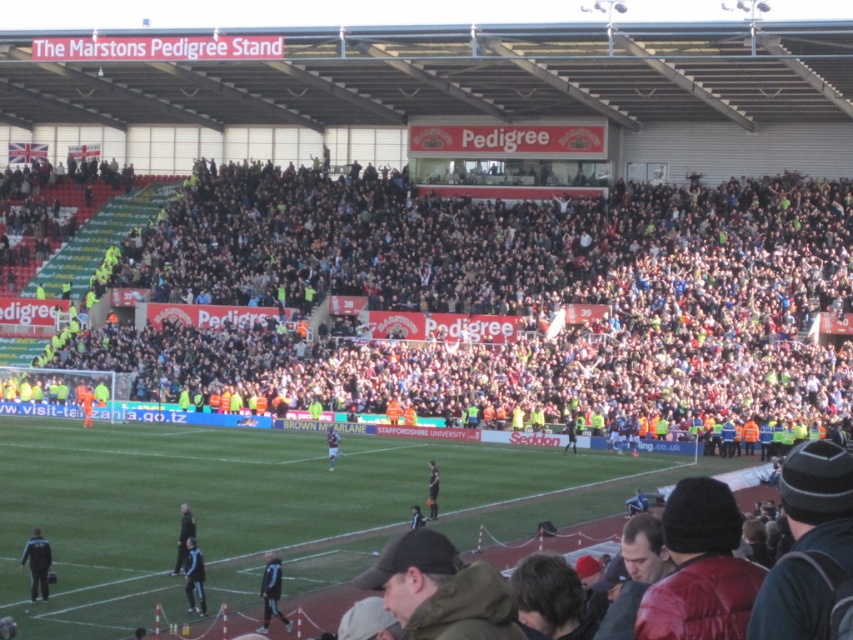
Is green grass football field at center positioned before light brown leather jacket at center?

Yes, it is.

Does green grass football field at center have a lesser width compared to light brown leather jacket at center?

Incorrect, green grass football field at center's width is not less than light brown leather jacket at center's.

Does point (287, 602) lie behind point (334, 461)?

That is False.

Identify the location of green grass football field at center. (262, 508).

Where is `green grass football field at center`? The height and width of the screenshot is (640, 853). green grass football field at center is located at coordinates (262, 508).

Can you confirm if green grass football field at center is positioned below dark blue jersey at center?

Incorrect, green grass football field at center is not positioned below dark blue jersey at center.

Between point (494, 456) and point (265, 588), which one is positioned behind?

Point (494, 456)

I want to click on green grass football field at center, so click(262, 508).

Can you confirm if dark blue jacket at lower left is positioned below dark blue jersey at center?

Actually, dark blue jacket at lower left is above dark blue jersey at center.

At what (x,y) coordinates should I click in order to perform the action: click on dark blue jacket at lower left. Please return your answer as a coordinate pair (x, y). The image size is (853, 640). Looking at the image, I should click on (38, 564).